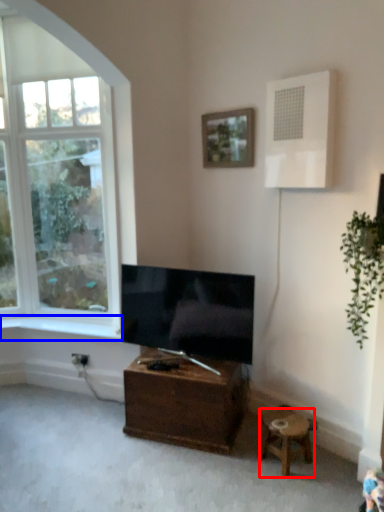
Question: Which of the following is the farthest to the observer, stool (highlighted by a red box) or window sill (highlighted by a blue box)?

Choices:
 (A) stool
 (B) window sill

Answer: (B)